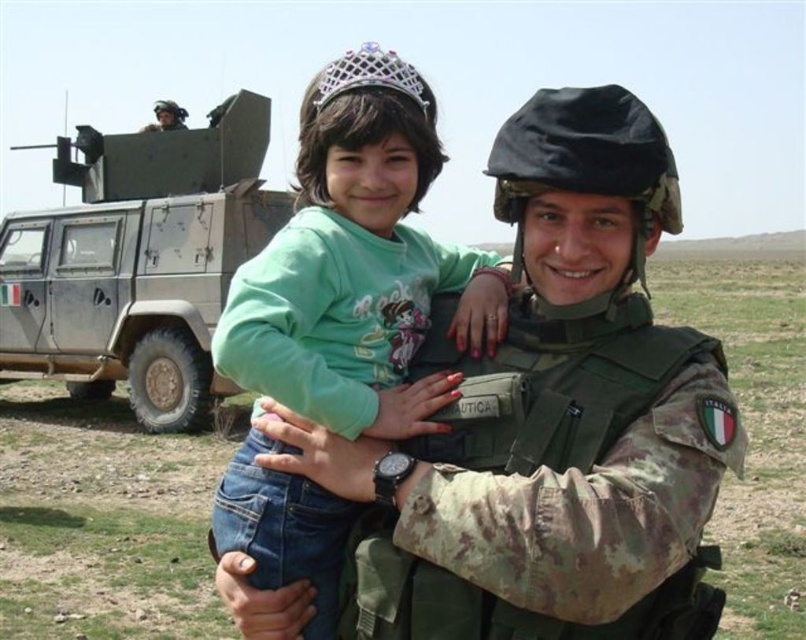
Is green matte shirt at center smaller than matte black helmet at upper left?

Yes, green matte shirt at center is smaller than matte black helmet at upper left.

Between point (302, 154) and point (173, 113), which one is positioned in front?

Point (302, 154)

I want to click on green matte shirt at center, so click(358, 264).

Which is behind, point (337, 156) or point (237, 147)?

The point (237, 147) is behind.

The height and width of the screenshot is (640, 806). I want to click on green matte shirt at center, so click(x=358, y=264).

How much distance is there between camouflage military vehicle at upper left and matte black helmet at upper left?

camouflage military vehicle at upper left is 4.52 meters from matte black helmet at upper left.

Can you confirm if camouflage military vehicle at upper left is wider than matte black helmet at upper left?

No, camouflage military vehicle at upper left is not wider than matte black helmet at upper left.

Locate an element on the screen. The image size is (806, 640). camouflage military vehicle at upper left is located at coordinates (139, 260).